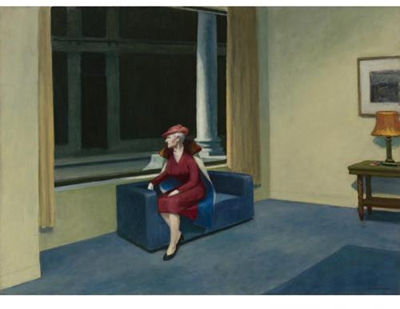
Locate an element on the screen. The height and width of the screenshot is (309, 400). shade is located at coordinates (390, 126).